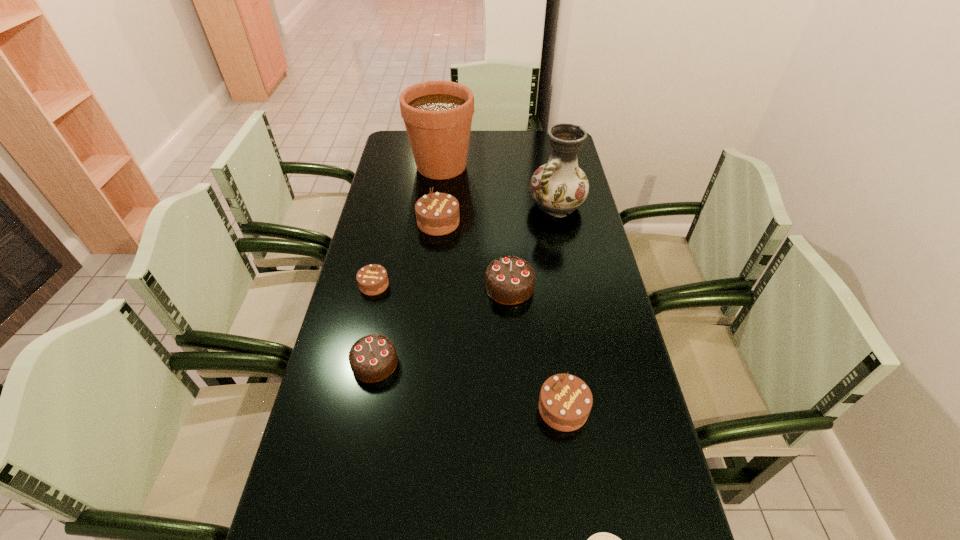
The width and height of the screenshot is (960, 540). I want to click on vacant point located between the second smallest brown chocolate cake and the second brown chocolate cake from right to left, so click(x=501, y=315).

Locate an element on the screen. This screenshot has height=540, width=960. vacant space in between the farthest object and the vase is located at coordinates (499, 186).

Where is `vacant point located between the fourth farthest chocolate cake and the flowerpot`? This screenshot has width=960, height=540. vacant point located between the fourth farthest chocolate cake and the flowerpot is located at coordinates [408, 265].

Locate an element on the screen. The image size is (960, 540). object that is the fourth closest one to the seventh tallest object is located at coordinates (438, 115).

Where is `object that is the nearest to the second nearest object`? object that is the nearest to the second nearest object is located at coordinates (602, 539).

At what (x,y) coordinates should I click in order to perform the action: click on chocolate cake object that ranks as the third closest to the shortest chocolate cake. Please return your answer as a coordinate pair (x, y). Looking at the image, I should click on (510, 280).

Choose which chocolate cake is the fourth nearest neighbor to the shortest object. Please provide its 2D coordinates. Your answer should be formatted as a tuple, i.e. [(x, y)], where the tuple contains the x and y coordinates of a point satisfying the conditions above.

[(372, 279)]

Identify the location of brown chocolate cake that stands as the closest to the third nearest object. (372, 279).

Locate an element on the screen. The width and height of the screenshot is (960, 540). brown chocolate cake that is the third closest one to the farther chocolate chocolate cake is located at coordinates (372, 279).

This screenshot has height=540, width=960. Identify the location of chocolate chocolate cake that is the closest to the smallest brown chocolate cake. coord(373,358).